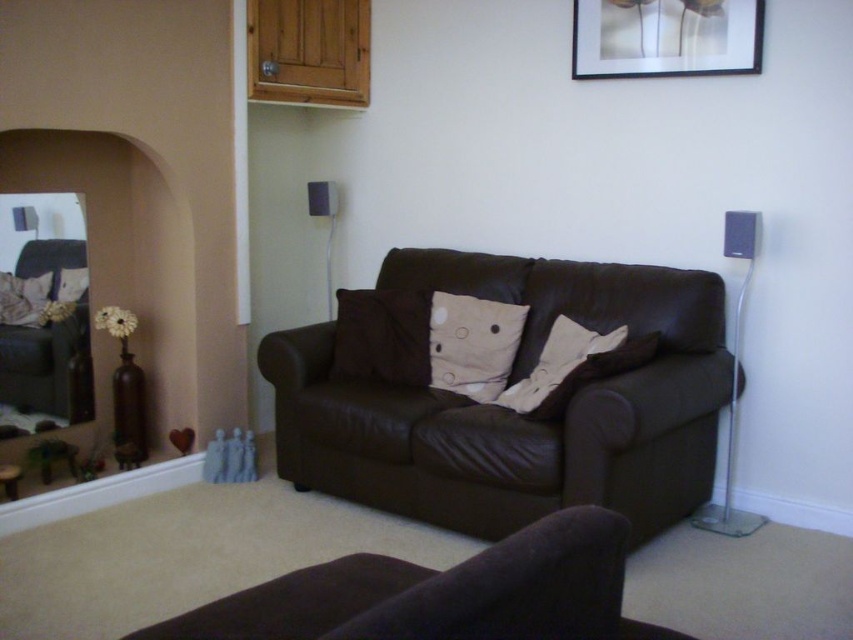
Question: Which of the following is the farthest from the observer?

Choices:
 (A) beige cotton pillow at center
 (B) brown leather couch at center
 (C) matte black speaker at center
 (D) suede-like brown armchair at lower center

Answer: (C)

Question: Does velvet brown armchair at left come in front of beige cotton pillow at center?

Choices:
 (A) no
 (B) yes

Answer: (B)

Question: Does beige cotton pillow at center have a smaller size compared to black plastic speaker at right?

Choices:
 (A) yes
 (B) no

Answer: (A)

Question: Which is nearer to the matte black picture frame at upper center?

Choices:
 (A) black plastic speaker at right
 (B) velvet brown armchair at left

Answer: (A)

Question: Does velvet brown armchair at left lie in front of white cotton pillow at center?

Choices:
 (A) yes
 (B) no

Answer: (B)

Question: Which of the following is the farthest from the observer?

Choices:
 (A) (578, 621)
 (B) (666, 61)

Answer: (B)